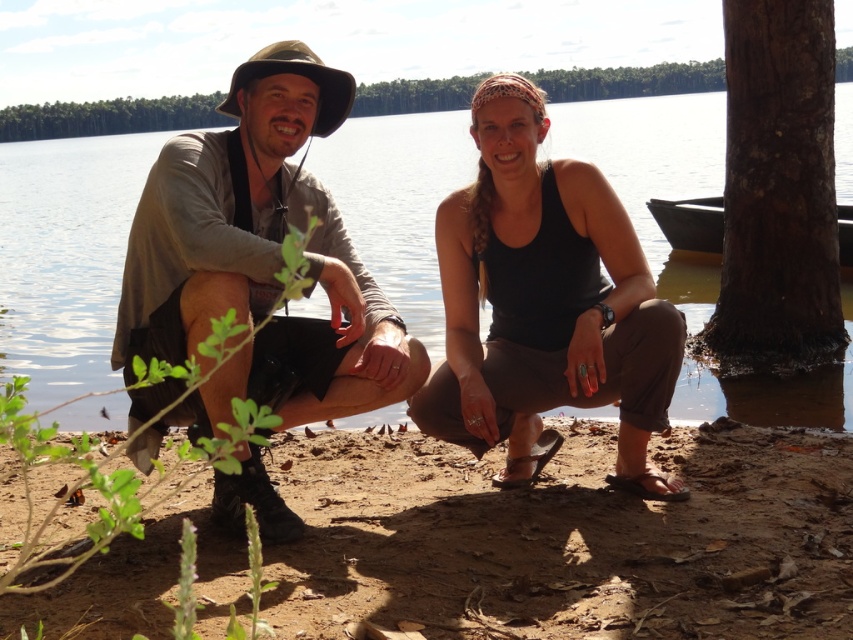
You are standing at the shoreline and want to walk towards the brown rough bark tree at right. Which direction should you walk to avoid stepping on the brown dirt at lower center?

To avoid stepping on the brown dirt at lower center, you should walk to the side of the brown rough bark tree at right since the brown dirt at lower center is in front of it.

You are a photographer trying to capture both the brown rough bark tree at right and the green leafy tree at upper center in the same frame. Which tree should you position closer to the left side of your camera viewfinder to include both?

To include both the brown rough bark tree at right and the green leafy tree at upper center in the same frame, position the brown rough bark tree at right closer to the left side of your camera viewfinder since it is already on the right side of the green leafy tree at upper center.

You are standing at the origin point of the coordinate system in the image. You see a brown dirt at lower center located at point (567,540). If you want to walk to the brown dirt at lower center, which direction should you move in?

The brown dirt at lower center is located at coordinate point (567,540), so you should move towards the lower center direction to reach it.